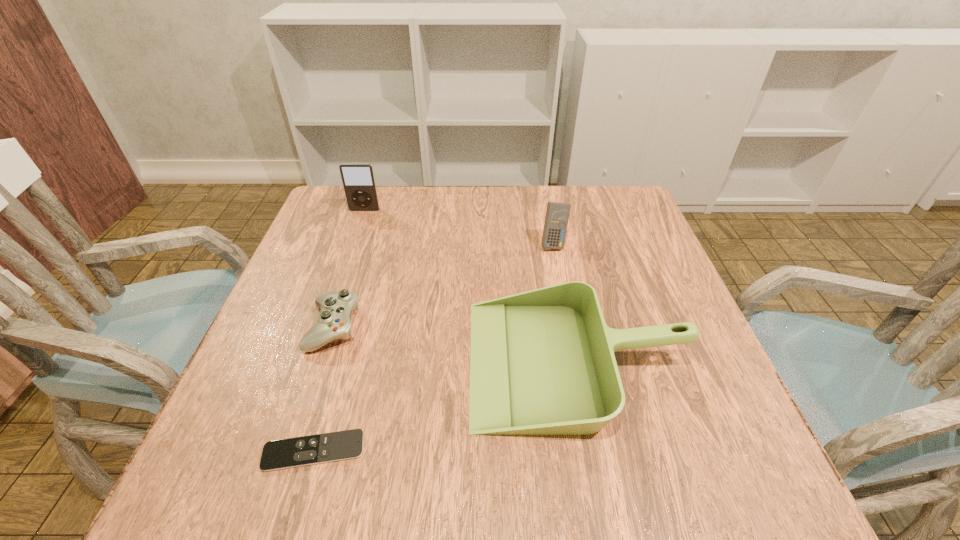
Identify the location of the tallest object. (358, 179).

You are a GUI agent. You are given a task and a screenshot of the screen. Output one action in this format:
    pyautogui.click(x=<x>, y=<y>)
    Task: Click on the farthest object
    The width and height of the screenshot is (960, 540).
    Given the screenshot: What is the action you would take?
    pyautogui.click(x=358, y=179)

The height and width of the screenshot is (540, 960). I want to click on calculator, so 557,214.

Locate an element on the screen. This screenshot has width=960, height=540. the third shortest object is located at coordinates (542, 362).

Image resolution: width=960 pixels, height=540 pixels. What are the coordinates of `control` in the screenshot? It's located at (334, 322).

This screenshot has width=960, height=540. I want to click on the shortest object, so click(x=314, y=449).

The image size is (960, 540). Find the location of `free spot located on the front-facing side of the farthest object`. free spot located on the front-facing side of the farthest object is located at coordinates (332, 304).

Locate an element on the screen. The width and height of the screenshot is (960, 540). free point located 0.150m on the front-facing side of the calculator is located at coordinates (564, 295).

Find the location of a particular element. Image resolution: width=960 pixels, height=540 pixels. vacant space situated 0.090m on the scoop of the dustpan is located at coordinates (423, 361).

This screenshot has width=960, height=540. In order to click on vacant space located on the scoop of the dustpan in this screenshot , I will do `click(282, 361)`.